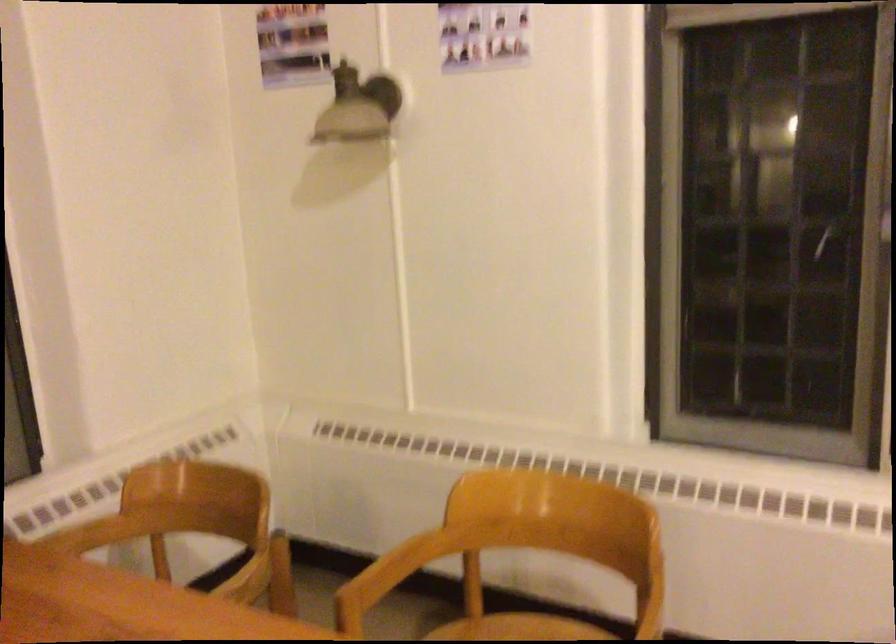
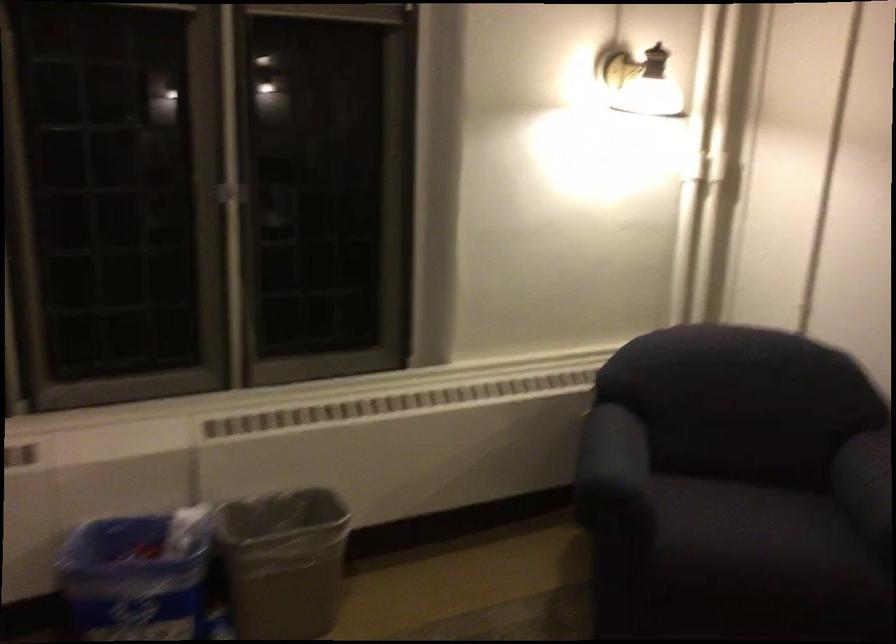
Question: Based on the continuous images, in which direction is the camera rotating? Reply with the corresponding letter.

Choices:
 (A) Left
 (B) Right
 (C) Up
 (D) Down

Answer: (B)